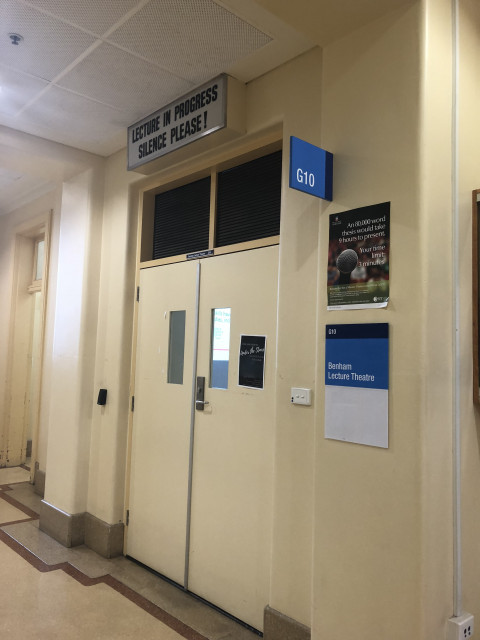
Where is `light switches`? The height and width of the screenshot is (640, 480). light switches is located at coordinates (301, 396).